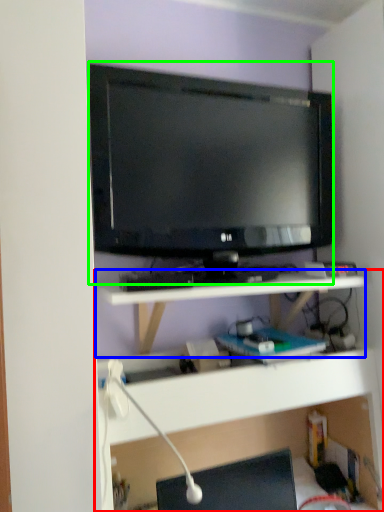
Question: Which is nearer to the shelf (highlighted by a red box)? shelf (highlighted by a blue box) or television (highlighted by a green box).

Choices:
 (A) shelf
 (B) television

Answer: (A)